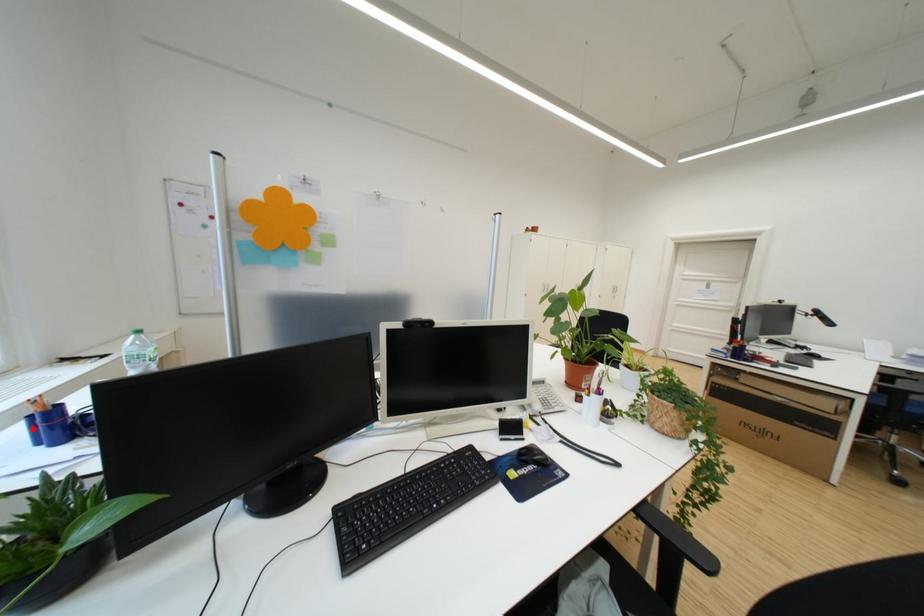
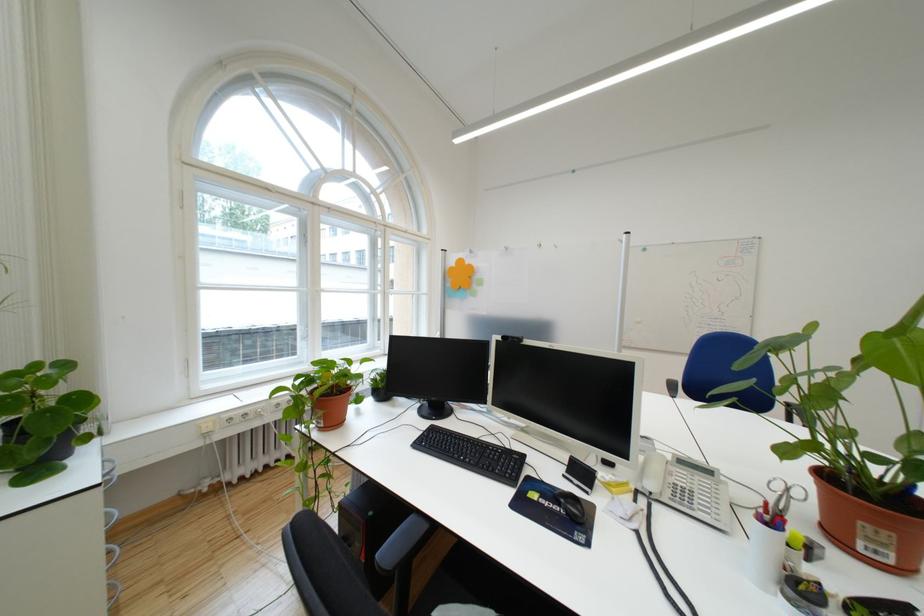
Question: I am providing you with two images of the same scene from different viewpoints. A red point is marked on the first image. Can you still see the location of the red point in image 2?

Choices:
 (A) Yes
 (B) No

Answer: (B)